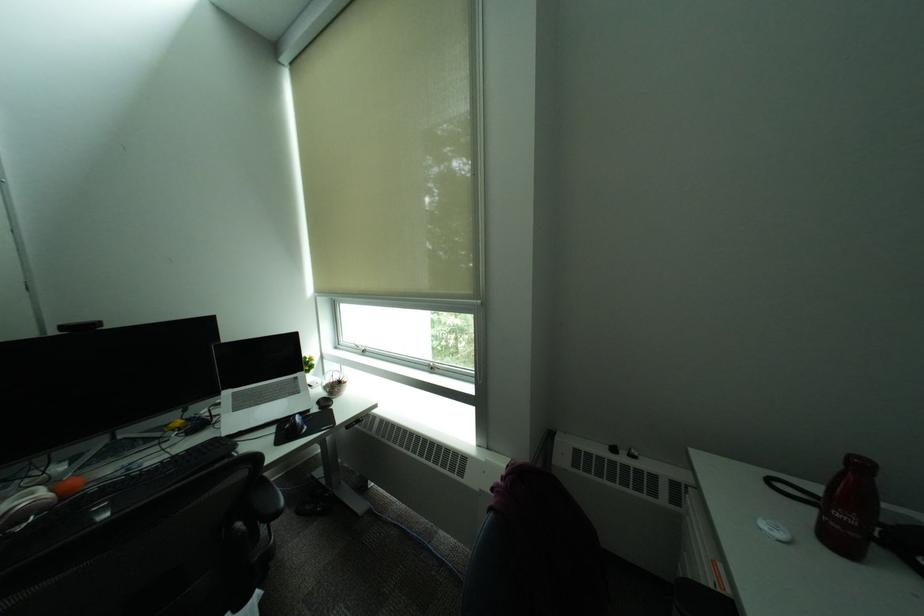
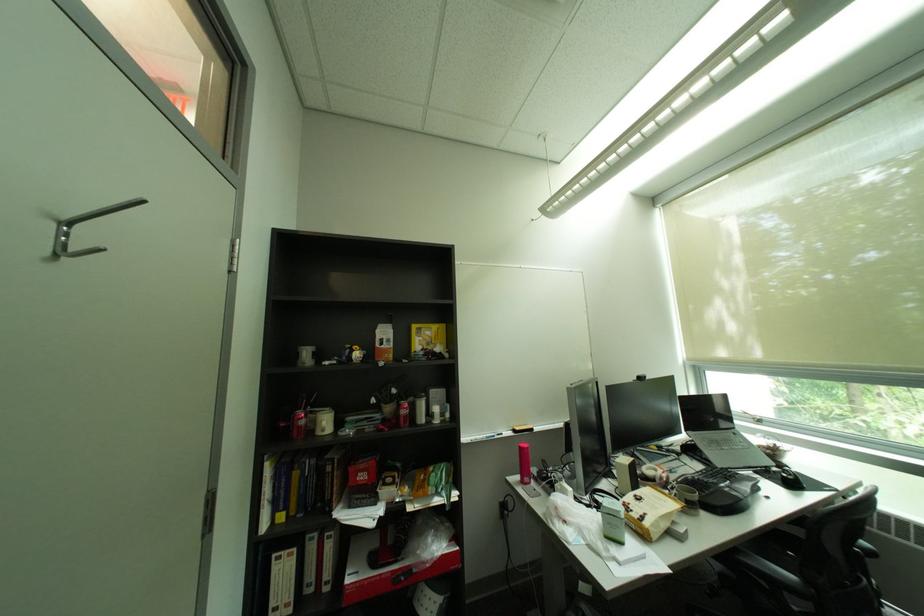
Find the pixel in the second image that matches point 187,456 in the first image.

(712, 472)